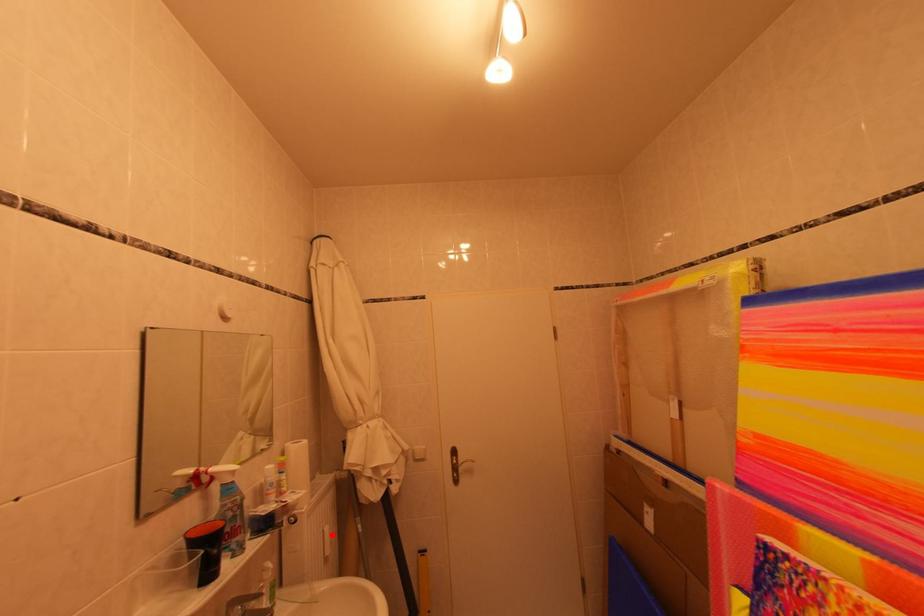
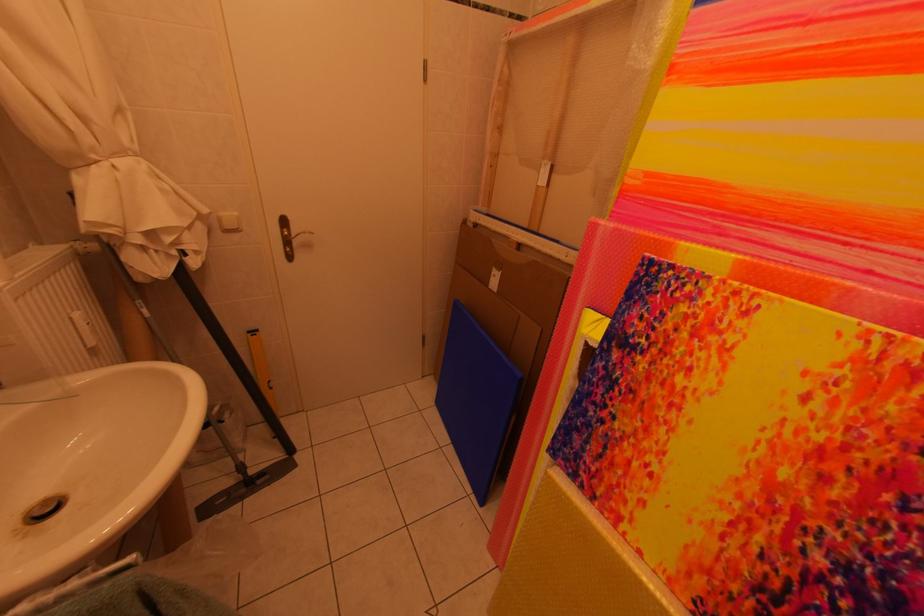
The point at the highlighted location is marked in the first image. Where is the corresponding point in the second image?

(79, 321)